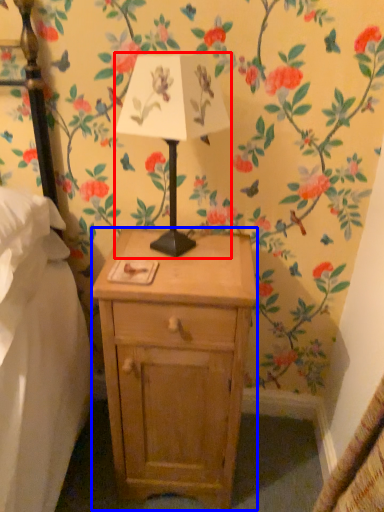
Question: Among these objects, which one is nearest to the camera, table lamp (highlighted by a red box) or nightstand (highlighted by a blue box)?

Choices:
 (A) table lamp
 (B) nightstand

Answer: (A)